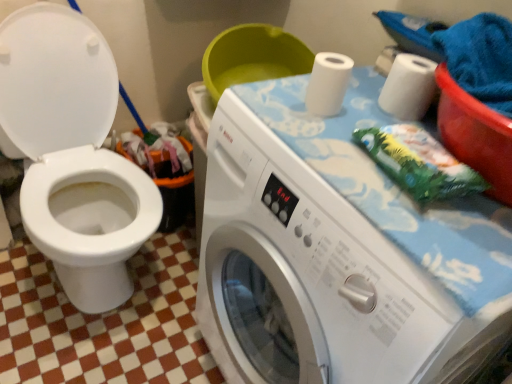
Where is `free region on the left part of white matte toilet paper at upper right, marked as the 2th toilet paper in a left-to-right arrangement`? Image resolution: width=512 pixels, height=384 pixels. free region on the left part of white matte toilet paper at upper right, marked as the 2th toilet paper in a left-to-right arrangement is located at coordinates (332, 117).